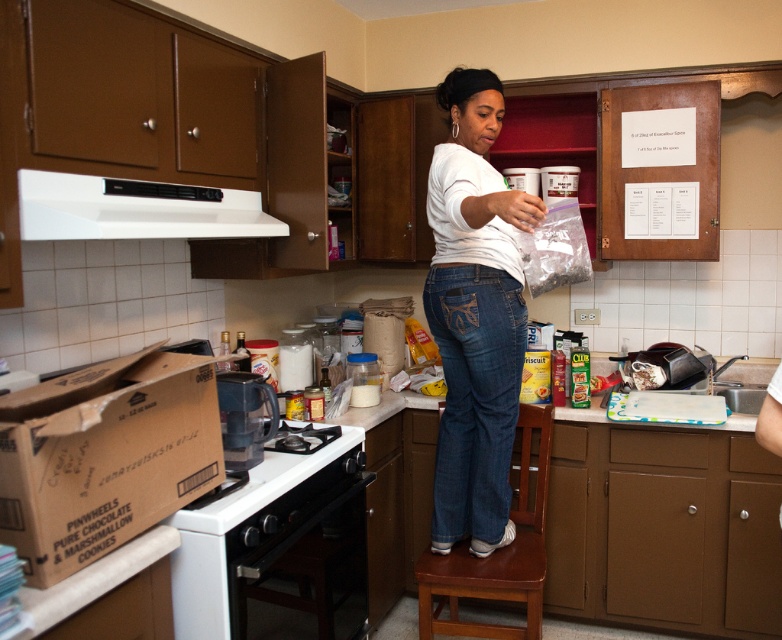
What is the 2D coordinate of the white matte exhaust hood at upper center in the image?

The white matte exhaust hood at upper center is located at the 2D coordinate point of (133,211).

Consider the image. You are organizing items in the kitchen and need to place a new item between the brown cardboard box at lower left and the white matte exhaust hood at upper center. Is this possible given their positions?

The brown cardboard box at lower left is to the right of the white matte exhaust hood at upper center, so there is no space between them for placing a new item as they are positioned side by side.

Looking at this image, you are a chef in the kitchen and need to decide which item is larger between the white cotton shirt at center and the white matte exhaust hood at upper center. Which one do you choose?

The white cotton shirt at center is bigger than the white matte exhaust hood at upper center, so you should choose the white cotton shirt at center as the larger item.